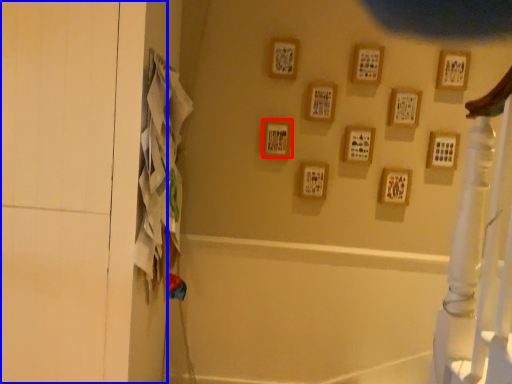
Question: Which of the following is the farthest to the observer, picture frame (highlighted by a red box) or screen door (highlighted by a blue box)?

Choices:
 (A) picture frame
 (B) screen door

Answer: (A)